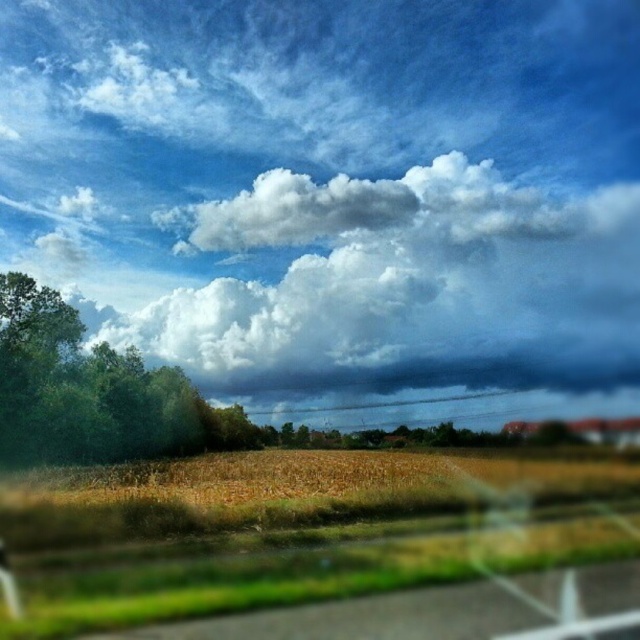
You are standing at the point with coordinates point (17, 308) and want to look at the point with coordinates point (573, 387). Can you see it clearly?

Point (573, 387) is behind point (17, 308), so you cannot see it clearly.

You are an airplane pilot flying over a rural area. You notice a white fluffy cloud at upper center and a green leafy tree at left. Which object is located to the right of the other?

The white fluffy cloud at upper center is positioned on the right side of green leafy tree at left.